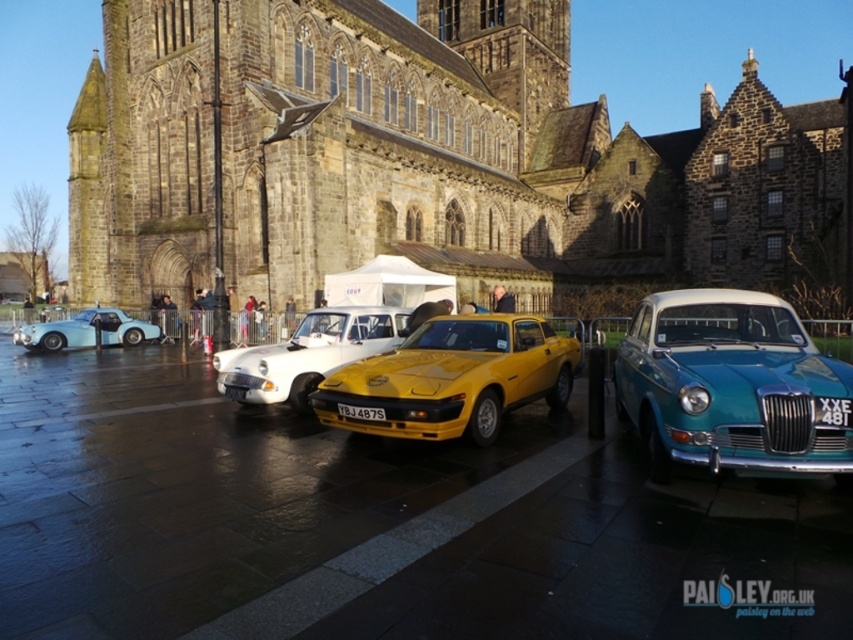
Where is the dark stone church at center located in the image?

The dark stone church at center is located at point 0.244 on the x axis and 0.488 on the y axis.

From the picture: You are standing at the point with coordinates (415,156) in this scene. What object is located exactly at that point?

The dark stone church at center is located exactly at point (415,156).